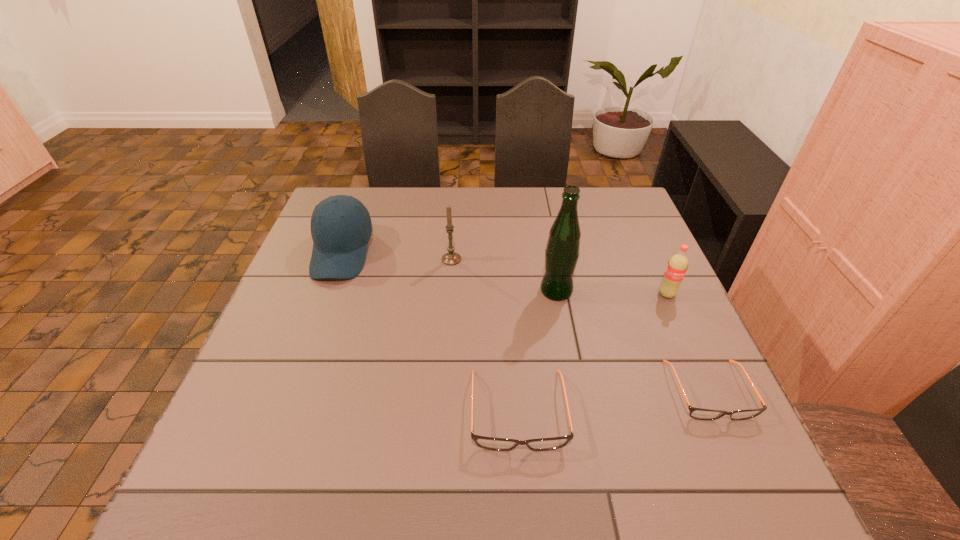
This screenshot has height=540, width=960. Find the location of `vacant area that lies between the shortest object and the baseball cap`. vacant area that lies between the shortest object and the baseball cap is located at coordinates (525, 322).

Where is `vacant space that's between the beer bottle and the soda`? This screenshot has width=960, height=540. vacant space that's between the beer bottle and the soda is located at coordinates (612, 293).

Identify which object is the closest to the tallest object. Please provide its 2D coordinates. Your answer should be formatted as a tuple, i.e. [(x, y)], where the tuple contains the x and y coordinates of a point satisfying the conditions above.

[(497, 444)]

Where is `object that is the closest to the baseball cap`? object that is the closest to the baseball cap is located at coordinates (451, 258).

Where is `vacant position in the image that satisfies the following two spatial constraints: 1. on the front-facing side of the soda; 2. on the right side of the baseball cap`? This screenshot has height=540, width=960. vacant position in the image that satisfies the following two spatial constraints: 1. on the front-facing side of the soda; 2. on the right side of the baseball cap is located at coordinates (326, 294).

At what (x,y) coordinates should I click in order to perform the action: click on free space in the image that satisfies the following two spatial constraints: 1. on the front-facing side of the candle; 2. on the left side of the leftmost object. Please return your answer as a coordinate pair (x, y). Looking at the image, I should click on (340, 259).

Identify the location of vacant area in the image that satisfies the following two spatial constraints: 1. on the front-facing side of the leftmost object; 2. on the right side of the second object from left to right. (340, 259).

This screenshot has width=960, height=540. What are the coordinates of `vacant space that satisfies the following two spatial constraints: 1. on the front-facing side of the candle; 2. on the right side of the baseball cap` in the screenshot? It's located at (340, 259).